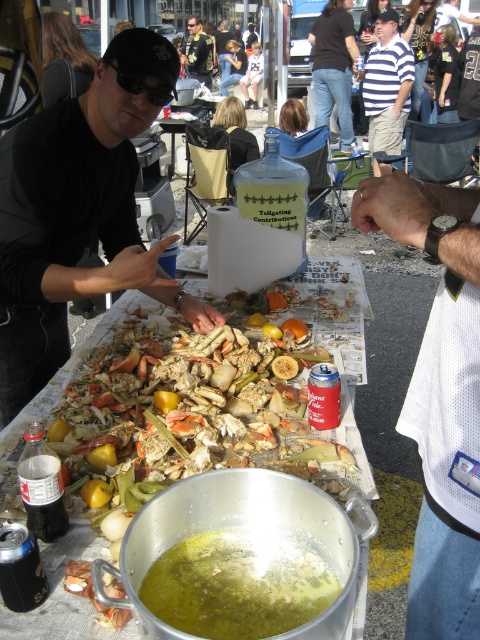
What do you see at coordinates (78, 216) in the screenshot? I see `black matte shirt at upper left` at bounding box center [78, 216].

Between black matte shirt at upper left and striped cotton shirt at center, which one has less height?

Standing shorter between the two is black matte shirt at upper left.

The width and height of the screenshot is (480, 640). I want to click on black matte shirt at upper left, so click(78, 216).

The width and height of the screenshot is (480, 640). What do you see at coordinates (386, 84) in the screenshot?
I see `striped cotton shirt at center` at bounding box center [386, 84].

Can you confirm if striped cotton shirt at center is taller than striped cotton shirt at upper center?

Correct, striped cotton shirt at center is much taller as striped cotton shirt at upper center.

Does point (388, 84) come closer to viewer compared to point (332, 81)?

Yes, it is.

Where is `striped cotton shirt at center`? striped cotton shirt at center is located at coordinates (386, 84).

Is black matte shirt at upper left to the right of white mesh shirt at center from the viewer's perspective?

No, black matte shirt at upper left is not to the right of white mesh shirt at center.

Between point (156, 40) and point (442, 515), which one is positioned behind?

Positioned behind is point (156, 40).

Describe the element at coordinates (78, 216) in the screenshot. I see `black matte shirt at upper left` at that location.

I want to click on black matte shirt at upper left, so click(78, 216).